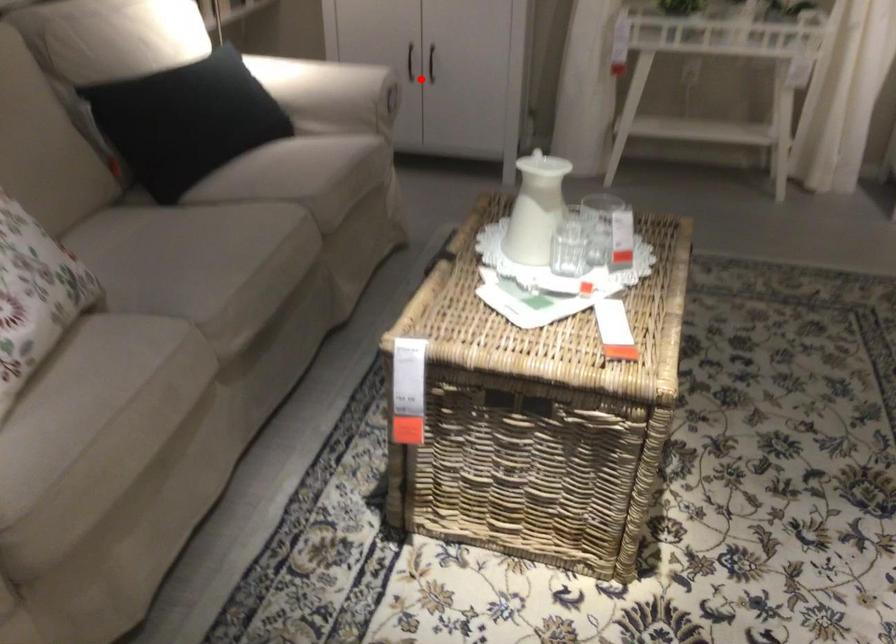
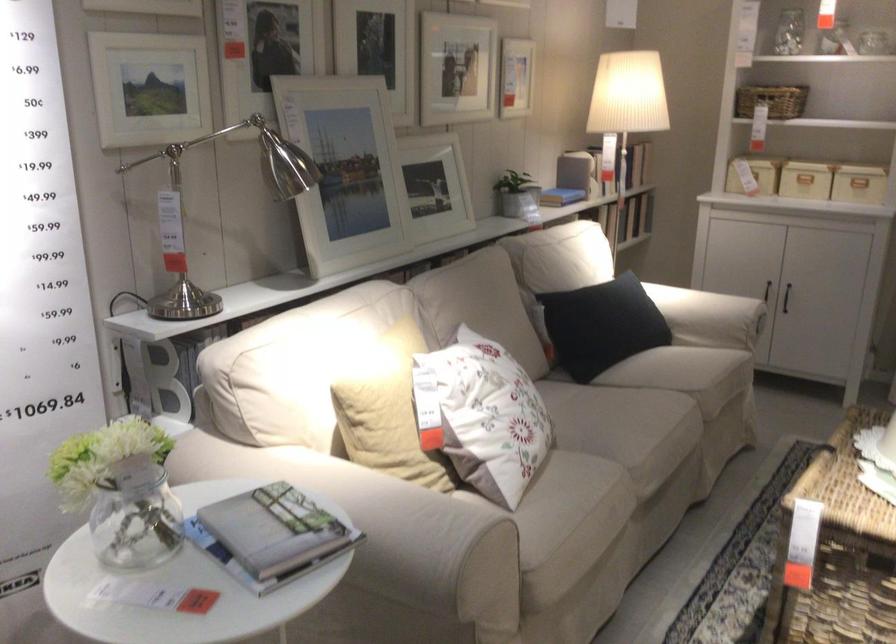
Where in the second image is the point corresponding to the highlighted location from the first image?

(786, 297)